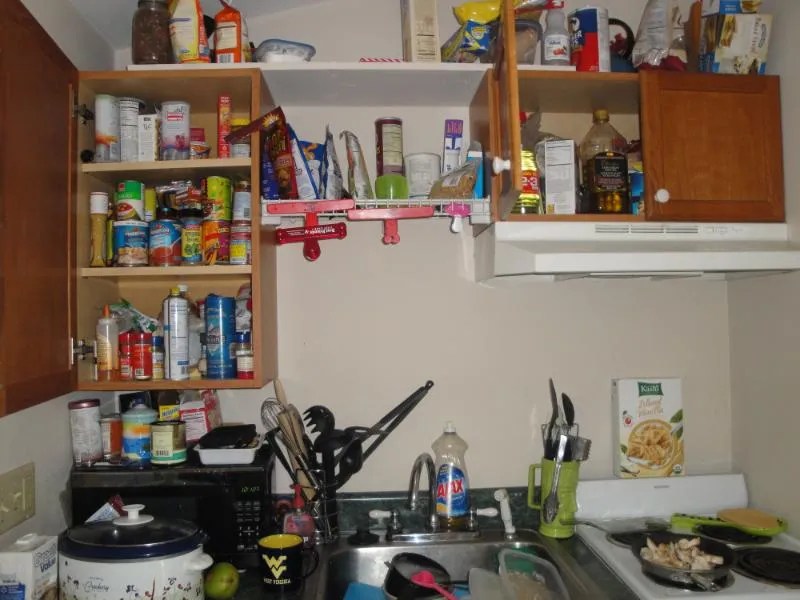
The width and height of the screenshot is (800, 600). Find the location of `walls`. walls is located at coordinates (430, 324), (770, 343), (32, 433).